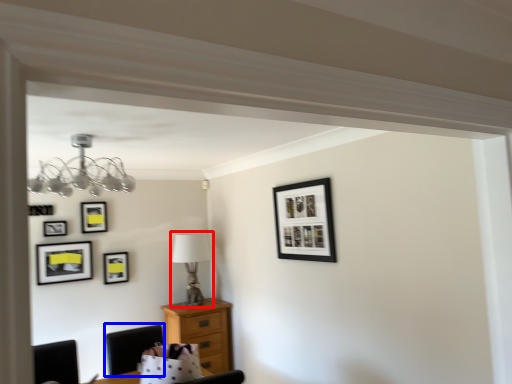
Question: Which point is further to the camera, table lamp (highlighted by a red box) or chair (highlighted by a blue box)?

Choices:
 (A) table lamp
 (B) chair

Answer: (A)